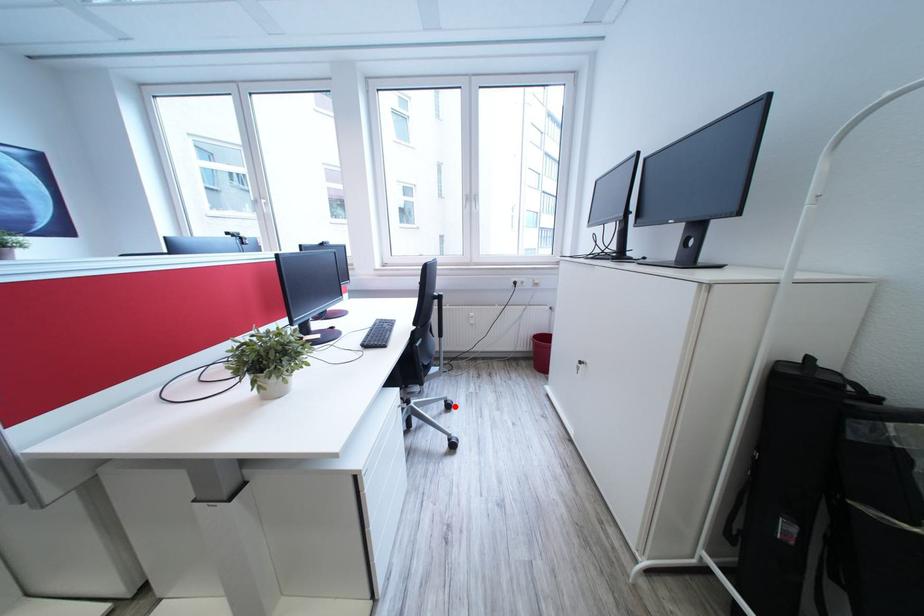
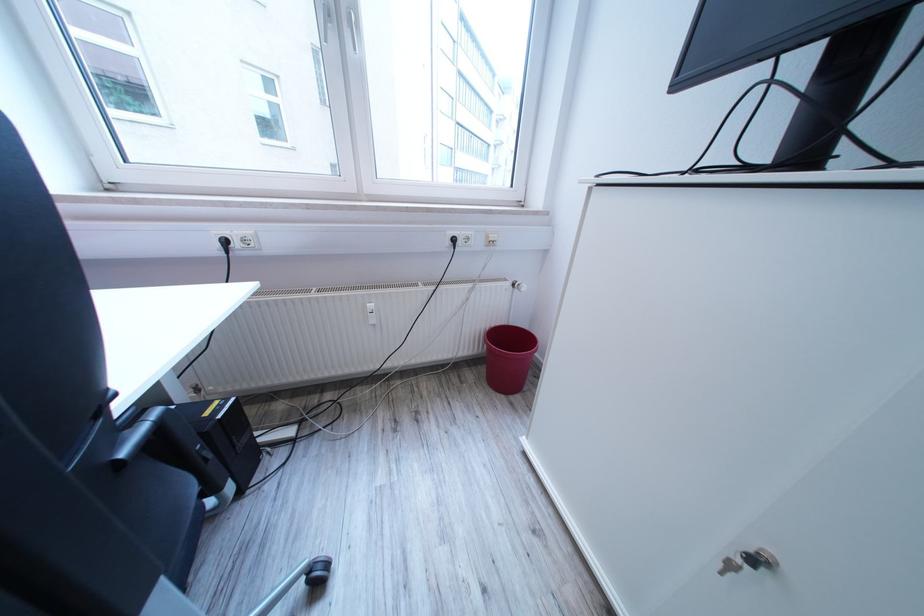
Question: I am providing you with two images of the same scene from different viewpoints. Image1 has a red point marked. In image2, the corresponding 3D location appears at what relative position? Reply with the corresponding letter.

Choices:
 (A) Closer
 (B) Farther

Answer: (B)